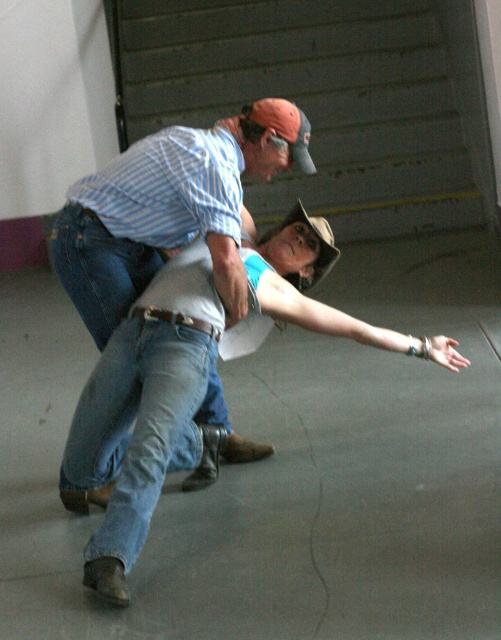
Does blue striped shirt at upper left lie in front of blue denim jeans at lower left?

That is False.

Measure the distance between point (133, 237) and camera.

Point (133, 237) is 2.94 meters away from camera.

This screenshot has width=501, height=640. What are the coordinates of `blue striped shirt at upper left` in the screenshot? It's located at (170, 209).

Can you confirm if denim jeans at center is thinner than blue striped shirt at upper left?

Incorrect, denim jeans at center's width is not less than blue striped shirt at upper left's.

Which is above, denim jeans at center or blue striped shirt at upper left?

blue striped shirt at upper left

Is point (157, 378) farther from viewer compared to point (136, 241)?

That is False.

Image resolution: width=501 pixels, height=640 pixels. What are the coordinates of `denim jeans at center` in the screenshot? It's located at (146, 413).

Between point (113, 369) and point (162, 461), which one is positioned in front?

Positioned in front is point (162, 461).

Does point (98, 435) come behind point (126, 360)?

That is True.

Where is `denim jeans at center`? denim jeans at center is located at coordinates (146, 413).